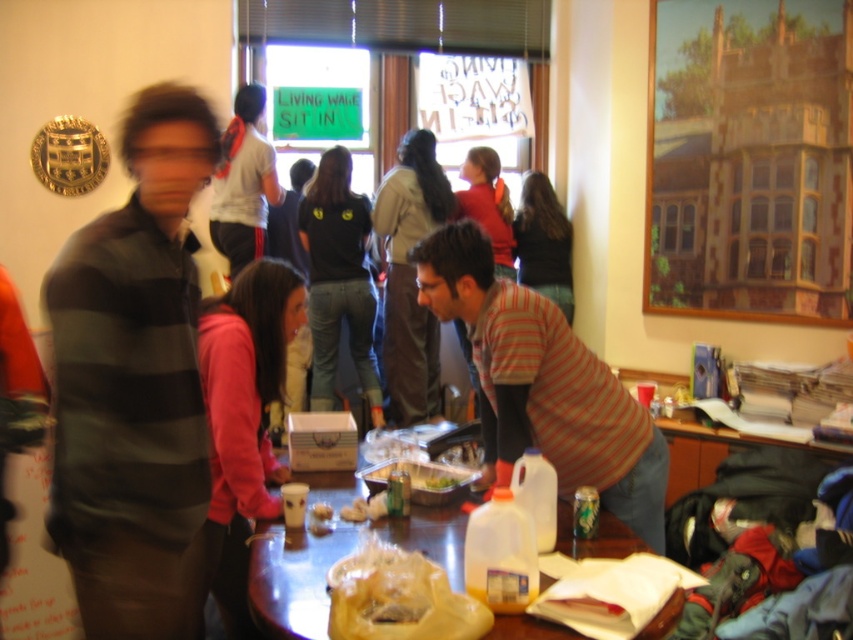
You are a photographer standing at the edge of the room. You want to take a photo of the striped cotton shirt at center without any obstruction. The camera you are using has a minimum focusing distance of 2 meters. Can you take the photo from your current position?

The striped cotton shirt at center and the camera are 1.95 meters apart from each other. Since the minimum focusing distance is 2 meters, you are too close to take a clear photo. You need to move back to ensure the distance is at least 2 meters.

You are a guest at the event and want to grab a drink from the table. You see the striped cotton shirt at center and the translucent plastic table at center. Which object is closer to you?

The striped cotton shirt at center is closer to you than the translucent plastic table at center.

You are organizing a community event and need to know the placement of items on the table. Which object is placed above the other between the striped cotton shirt at center and the translucent plastic table at center?

The striped cotton shirt at center is located above the translucent plastic table at center.